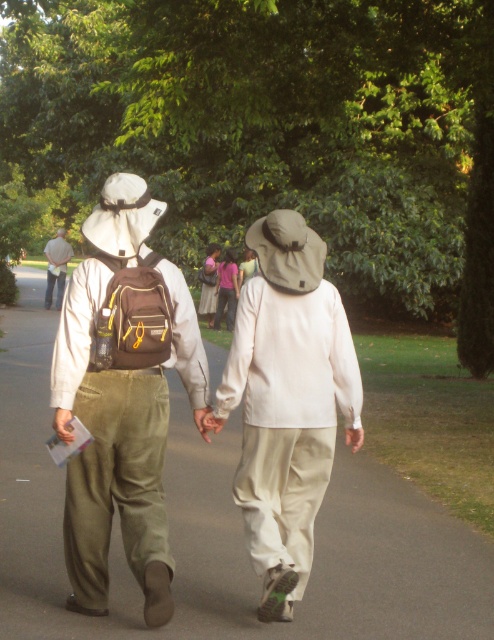
You are a photographer trying to capture a clear shot of the matte pink shirt at center without the matte brown backpack at left blocking the view. Based on their sizes, which object would you need to adjust your camera angle to avoid?

The matte brown backpack at left is taller than the matte pink shirt at center, so you would need to adjust your camera angle to avoid the taller matte brown backpack at left blocking the view of the matte pink shirt at center.

You are a photographer trying to capture a wide shot of the two people walking on the smooth asphalt path at center. Since you want to include both the people and the path in the frame, will the matte brown backpack at upper left be fully visible in your photo if you focus on the path?

The smooth asphalt path at center is larger in size than the matte brown backpack at upper left, so the backpack will be fully visible in the photo as it is smaller and part of the scene.